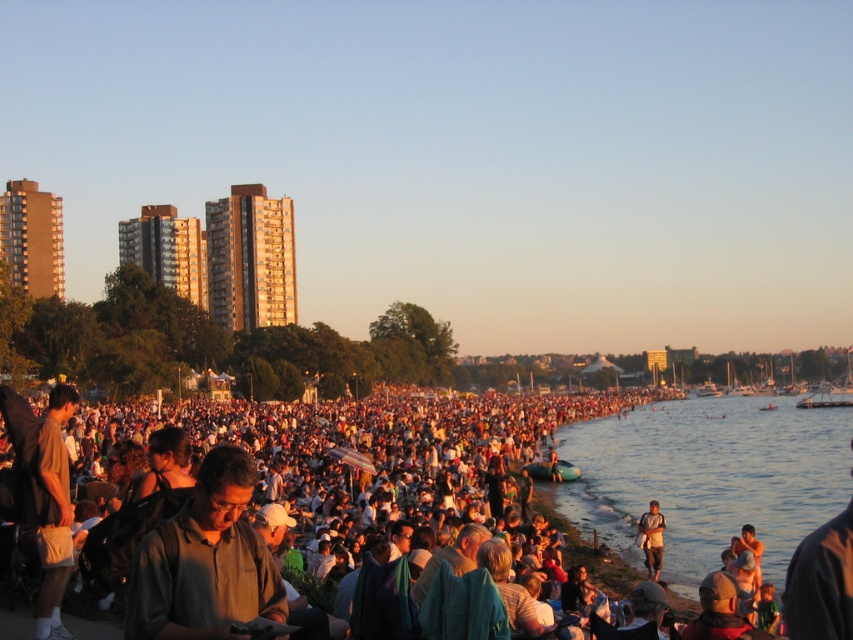
Does dark green shirt at center appear on the right side of light brown fabric shirt at lower right?

In fact, dark green shirt at center is to the left of light brown fabric shirt at lower right.

Between point (178, 621) and point (654, 566), which one is positioned in front?

Point (178, 621) is more forward.

Where is `dark green shirt at center`? The height and width of the screenshot is (640, 853). dark green shirt at center is located at coordinates (204, 561).

Between clear water at lower right and dark green shirt at center, which one is positioned higher?

dark green shirt at center is above.

Who is more distant from viewer, (764, 488) or (238, 557)?

Point (764, 488)

Where is `clear water at lower right`? This screenshot has width=853, height=640. clear water at lower right is located at coordinates (708, 477).

The image size is (853, 640). What do you see at coordinates (303, 516) in the screenshot?
I see `dark brown shirt at center` at bounding box center [303, 516].

Can you confirm if dark brown shirt at center is wider than light brown fabric shirt at lower right?

Yes, dark brown shirt at center is wider than light brown fabric shirt at lower right.

Does point (287, 524) come farther from viewer compared to point (643, 513)?

That is False.

The height and width of the screenshot is (640, 853). What are the coordinates of `dark brown shirt at center` in the screenshot? It's located at (303, 516).